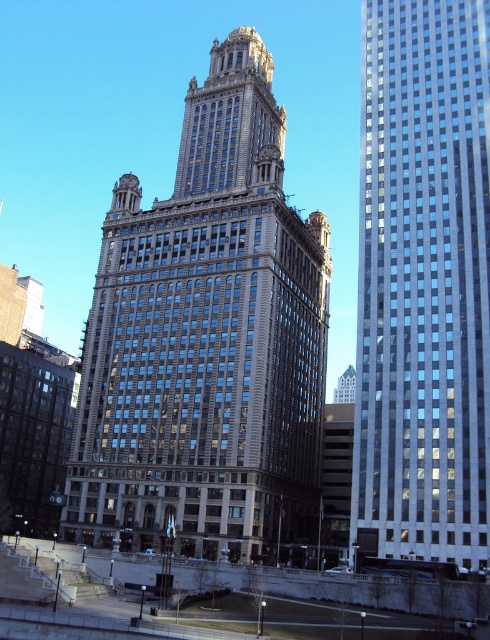
Question: Among these objects, which one is farthest from the camera?

Choices:
 (A) brown stone building at center
 (B) glassy reflective skyscraper at right

Answer: (A)

Question: Which object is farther from the camera taking this photo?

Choices:
 (A) brown stone building at center
 (B) glassy reflective skyscraper at right

Answer: (A)

Question: Can you confirm if brown stone building at center is positioned above glassy reflective skyscraper at right?

Choices:
 (A) yes
 (B) no

Answer: (A)

Question: Can you confirm if brown stone building at center is positioned to the right of glassy reflective skyscraper at right?

Choices:
 (A) yes
 (B) no

Answer: (B)

Question: Does brown stone building at center have a greater width compared to glassy reflective skyscraper at right?

Choices:
 (A) no
 (B) yes

Answer: (B)